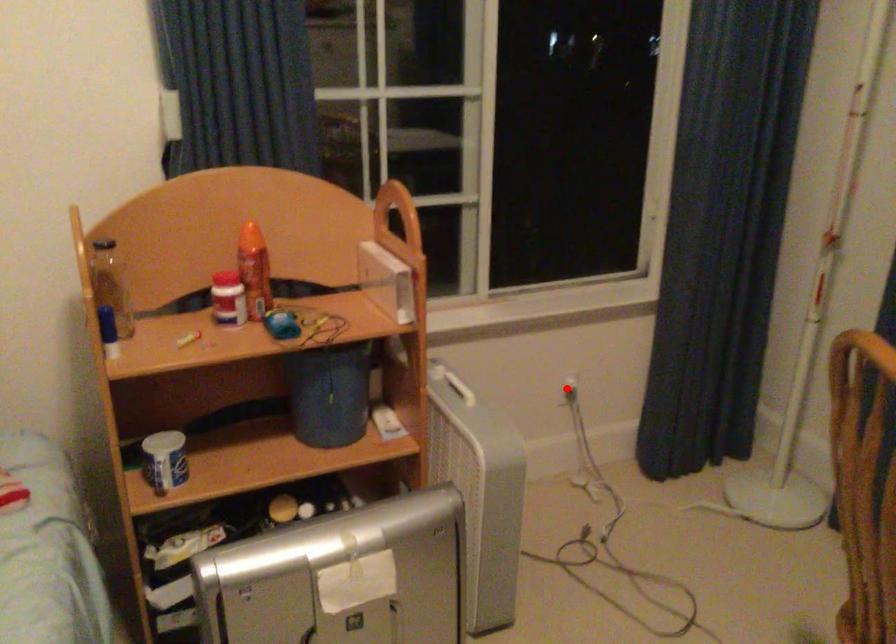
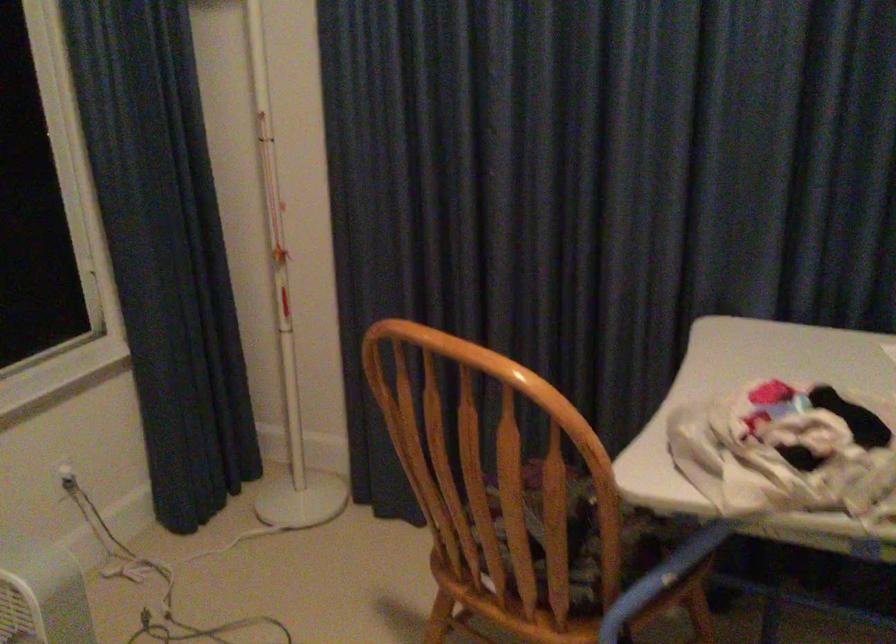
In the second image, find the point that corresponds to the highlighted location in the first image.

(65, 478)